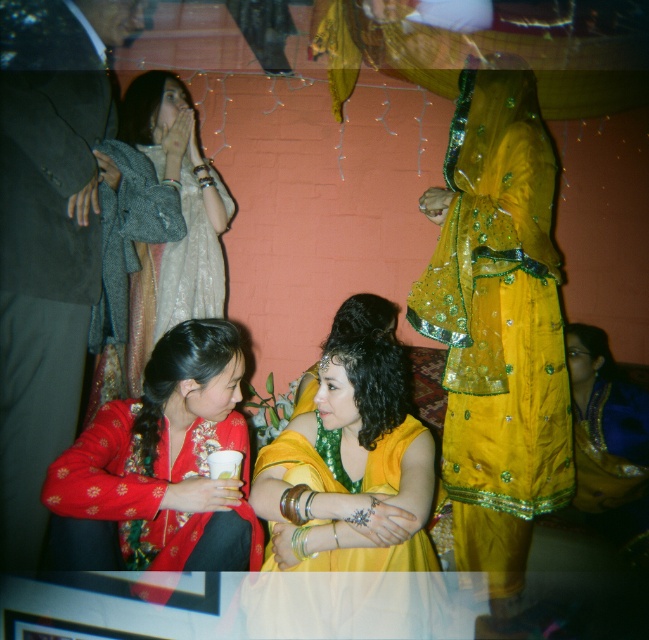
You are standing at the position of point (350, 548) and want to move towards the position of point (552, 412). Based on the scene description, will you be moving forward or backward?

Since point (552, 412) is behind point (350, 548), moving towards it would mean moving backward.

You are a photographer at the event and want to capture a closeup of the shiny yellow sari at center. Given that your camera has a minimum focus distance of 1.2 meters, will you be able to take the photo without moving closer?

The shiny yellow sari at center is 1.34 meters from camera. Since the minimum focus distance is 1.2 meters, the camera can focus on the shiny yellow sari at center as it is beyond the minimum required distance.

You are at a party and want to approach the shiny yellow dress at right and the shiny yellow sari at center. Which one is located to the right of the other?

The shiny yellow dress at right is positioned on the right side of the shiny yellow sari at center.